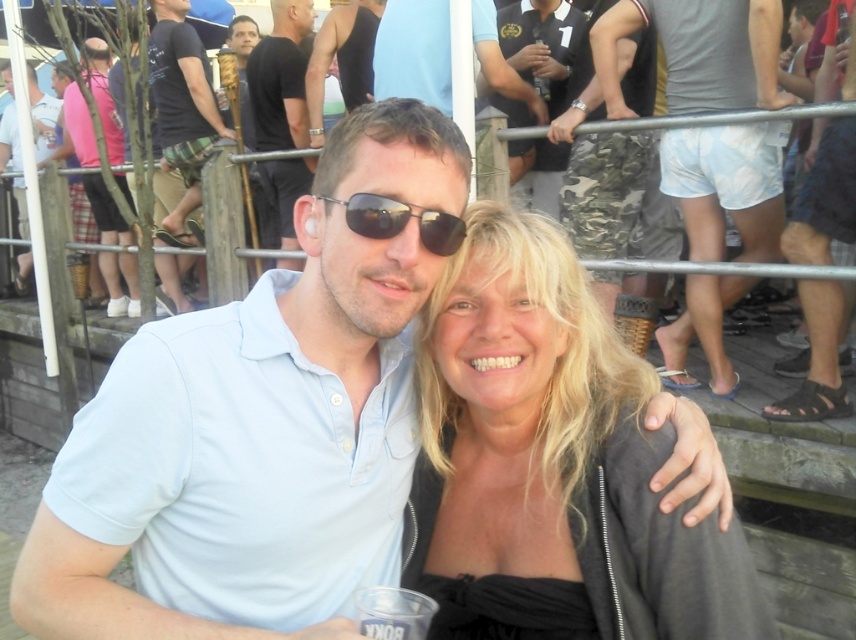
You are a photographer at the event and want to capture both the black matte shirt at center and the black matte tank top at upper center in a single photo. The camera you are using has a maximum focus range of 16 inches. Can you fit both subjects in the frame without moving the camera?

The black matte shirt at center and black matte tank top at upper center are 16.67 inches apart from each other. Since the distance between them exceeds the camera maximum focus range of 16 inches, you cannot fit both subjects in the frame without moving the camera.